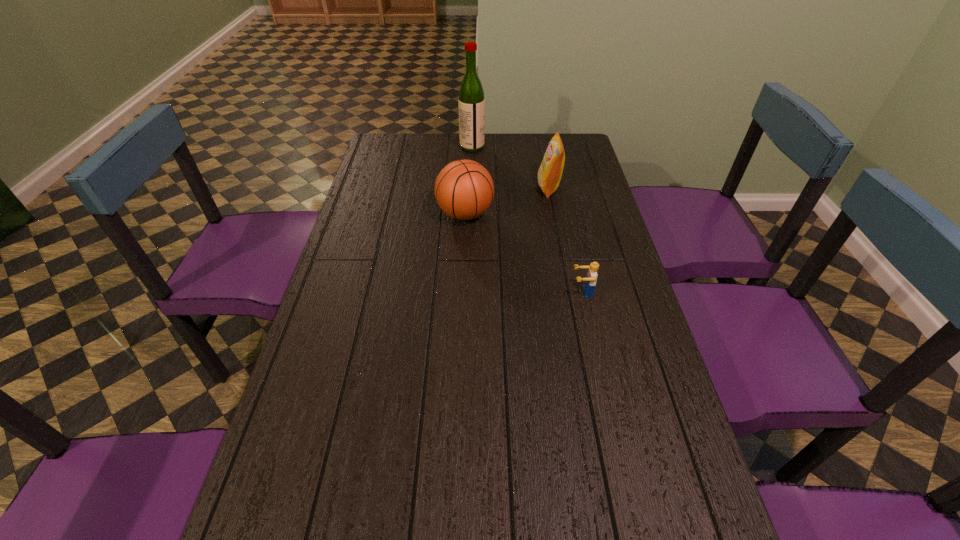
Identify the location of vacant space positioned on the front-facing side of the crisp (potato chip). (472, 188).

This screenshot has width=960, height=540. What are the coordinates of `free space located on the face of the shortest object` in the screenshot? It's located at (467, 292).

The image size is (960, 540). I want to click on free space located 0.200m on the face of the shortest object, so click(501, 292).

This screenshot has height=540, width=960. Identify the location of free region located on the face of the shortest object. (484, 292).

Locate an element on the screen. This screenshot has width=960, height=540. object that is at the far edge is located at coordinates (471, 102).

I want to click on crisp (potato chip) at the right edge, so click(549, 175).

The width and height of the screenshot is (960, 540). I want to click on Lego that is at the right edge, so click(590, 281).

This screenshot has width=960, height=540. I want to click on vacant position at the far edge of the desktop, so [x=455, y=157].

In the image, there is a desktop. Where is `vacant space at the left edge`? The width and height of the screenshot is (960, 540). vacant space at the left edge is located at coordinates (365, 243).

The image size is (960, 540). I want to click on blank space at the right edge of the desktop, so click(x=580, y=168).